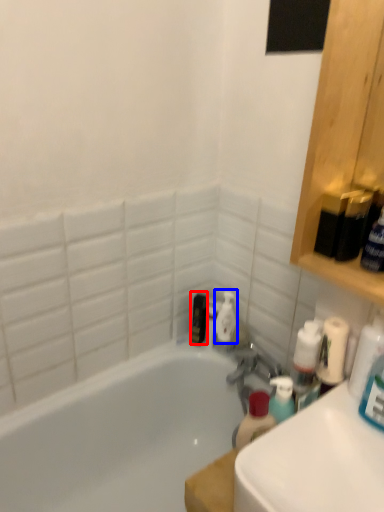
Question: Which of the following is the farthest to the observer, toiletry (highlighted by a red box) or cleaning product (highlighted by a blue box)?

Choices:
 (A) toiletry
 (B) cleaning product

Answer: (A)